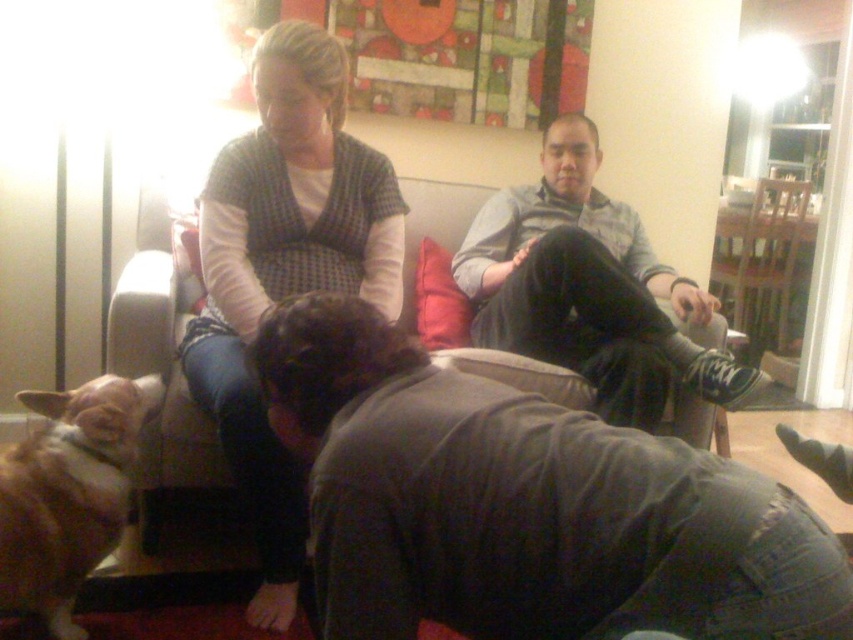
Question: Which point is closer to the camera taking this photo?

Choices:
 (A) (751, 269)
 (B) (167, 420)

Answer: (B)

Question: Which of the following is the farthest from the observer?

Choices:
 (A) (759, 275)
 (B) (585, 168)
 (C) (364, 333)
 (D) (171, 348)

Answer: (A)

Question: Is matte black sweater at center below dark gray sweater at center?

Choices:
 (A) no
 (B) yes

Answer: (B)

Question: Based on their relative distances, which object is nearer to the wooden chair at right?

Choices:
 (A) dark gray fabric at lower center
 (B) dark gray sweater at center
 (C) brown fur cat at lower left
 (D) matte black sweater at center

Answer: (B)

Question: Is beige fabric couch at center smaller than wooden chair at right?

Choices:
 (A) no
 (B) yes

Answer: (B)

Question: Can you confirm if beige fabric couch at center is positioned above brown fur cat at lower left?

Choices:
 (A) no
 (B) yes

Answer: (B)